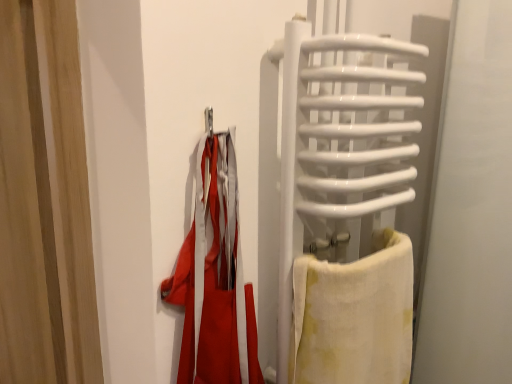
Question: Looking at the image, does white cotton towel at right seem bigger or smaller compared to white glossy towel rack at right?

Choices:
 (A) big
 (B) small

Answer: (B)

Question: Considering the positions of white cotton towel at right and white glossy towel rack at right in the image, is white cotton towel at right wider or thinner than white glossy towel rack at right?

Choices:
 (A) wide
 (B) thin

Answer: (B)

Question: Estimate the real-world distances between objects in this image. Which object is closer to the white glossy towel rack at right?

Choices:
 (A) white cotton towel at right
 (B) wooden curtain at left

Answer: (A)

Question: Which is farther from the white cotton towel at right?

Choices:
 (A) wooden curtain at left
 (B) white glossy towel rack at right

Answer: (A)